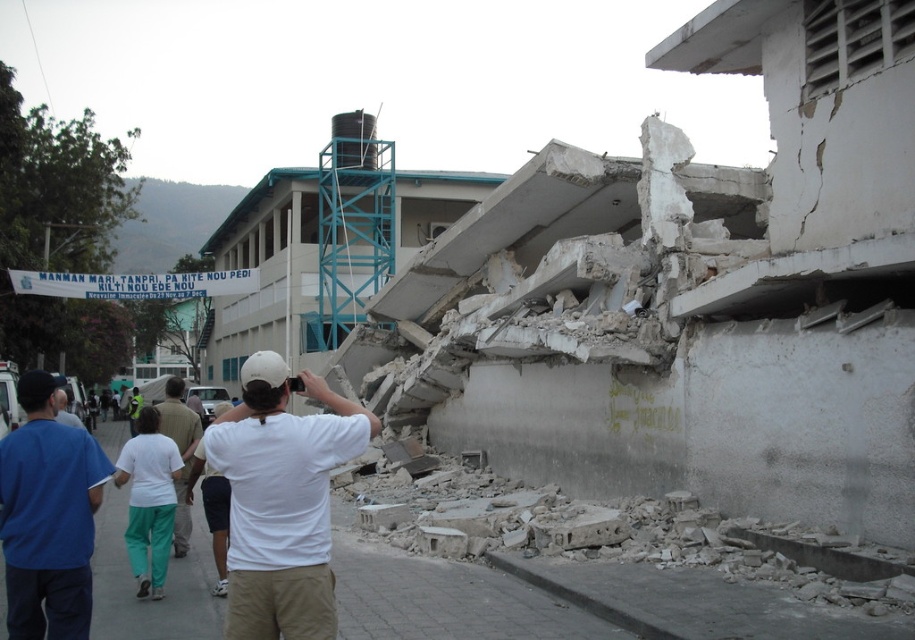
Question: Does white cotton shirt at center lie in front of white cotton shirt at lower left?

Choices:
 (A) yes
 (B) no

Answer: (A)

Question: Which point is closer to the camera?

Choices:
 (A) white cotton shirt at center
 (B) white cotton shirt at lower left
 (C) gray concrete pavement at lower center
 (D) white matte shirt at center

Answer: (A)

Question: Among these objects, which one is farthest from the camera?

Choices:
 (A) blue cotton shirt at left
 (B) white matte shirt at center
 (C) white cotton shirt at lower left
 (D) white cotton pants at lower left

Answer: (B)

Question: Estimate the real-world distances between objects in this image. Which object is farther from the blue cotton shirt at left?

Choices:
 (A) white matte shirt at center
 (B) white cotton pants at lower left

Answer: (A)

Question: Does white cotton shirt at center appear over white matte shirt at center?

Choices:
 (A) yes
 (B) no

Answer: (A)

Question: From the image, what is the correct spatial relationship of white cotton pants at lower left in relation to white cotton shirt at lower left?

Choices:
 (A) above
 (B) below

Answer: (B)